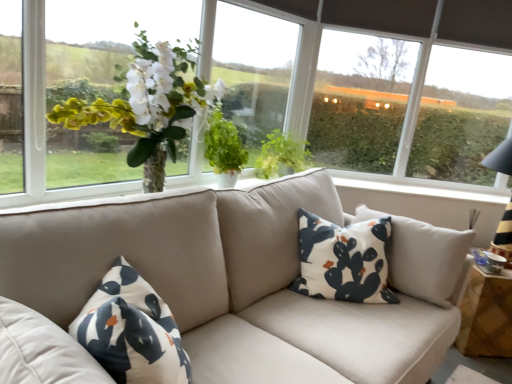
Question: Considering the relative sizes of transparent glass window at center, placed as the first window screen when sorted from left to right, and white cotton pillow at center in the image provided, is transparent glass window at center, placed as the first window screen when sorted from left to right, taller than white cotton pillow at center?

Choices:
 (A) yes
 (B) no

Answer: (A)

Question: Is the position of transparent glass window at center, the 2th window screen viewed from the right, more distant than that of white cotton pillow at center?

Choices:
 (A) yes
 (B) no

Answer: (A)

Question: From the image's perspective, does transparent glass window at center, placed as the first window screen when sorted from left to right, appear higher than white cotton pillow at center?

Choices:
 (A) yes
 (B) no

Answer: (A)

Question: Is transparent glass window at center, the 2th window screen viewed from the right, surrounding white cotton pillow at center?

Choices:
 (A) no
 (B) yes

Answer: (A)

Question: From a real-world perspective, is transparent glass window at center, placed as the first window screen when sorted from left to right, physically above white cotton pillow at center?

Choices:
 (A) no
 (B) yes

Answer: (B)

Question: Choose the correct answer: Is white cotton pillow at center inside matte glass vase at center or outside it?

Choices:
 (A) outside
 (B) inside

Answer: (A)

Question: Does point (348, 288) appear closer or farther from the camera than point (118, 94)?

Choices:
 (A) farther
 (B) closer

Answer: (A)

Question: From a real-world perspective, is white cotton pillow at center positioned above or below matte glass vase at center?

Choices:
 (A) below
 (B) above

Answer: (A)

Question: In terms of size, does white cotton pillow at center appear bigger or smaller than matte glass vase at center?

Choices:
 (A) big
 (B) small

Answer: (B)

Question: Based on their sizes in the image, would you say transparent glass window at center, placed as the first window screen when sorted from left to right, is bigger or smaller than transparent plastic window screen at upper right, acting as the 1th window screen starting from the right?

Choices:
 (A) big
 (B) small

Answer: (B)

Question: Considering their positions, is transparent glass window at center, placed as the first window screen when sorted from left to right, located in front of or behind transparent plastic window screen at upper right, acting as the 1th window screen starting from the right?

Choices:
 (A) behind
 (B) front

Answer: (B)

Question: Choose the correct answer: Is transparent glass window at center, placed as the first window screen when sorted from left to right, inside transparent plastic window screen at upper right, acting as the 1th window screen starting from the right, or outside it?

Choices:
 (A) inside
 (B) outside

Answer: (B)

Question: From a real-world perspective, is transparent glass window at center, placed as the first window screen when sorted from left to right, physically located above or below transparent plastic window screen at upper right, the second window screen when ordered from left to right?

Choices:
 (A) above
 (B) below

Answer: (B)

Question: From the image's perspective, is green leafy plant at center above or below transparent plastic window screen at upper right, acting as the 1th window screen starting from the right?

Choices:
 (A) above
 (B) below

Answer: (B)

Question: In terms of size, does green leafy plant at center appear bigger or smaller than transparent plastic window screen at upper right, the second window screen when ordered from left to right?

Choices:
 (A) small
 (B) big

Answer: (A)